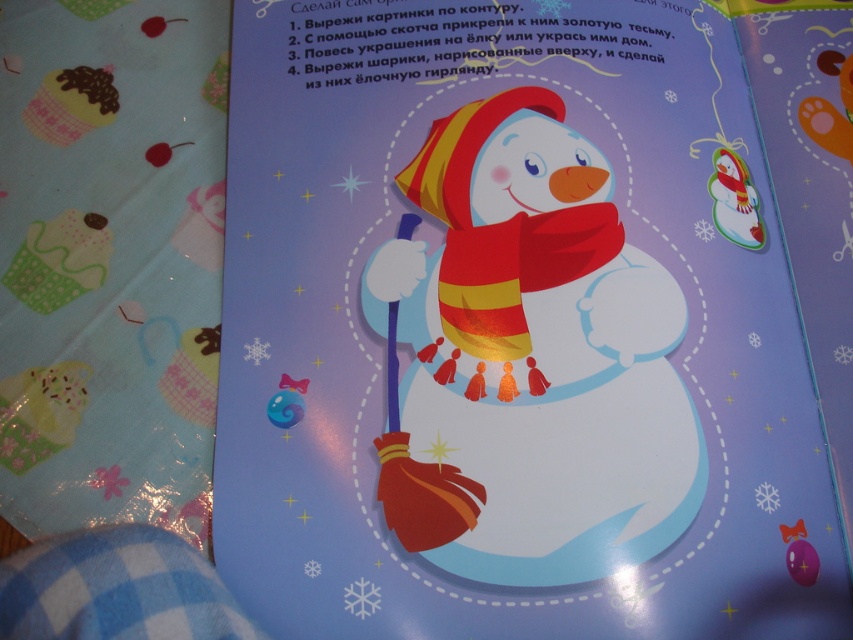
You are an artist drawing a snowman on a page. You want to place the snowman exactly at the center of the page. According to the image, is the matte paper snowman at center positioned correctly?

The matte paper snowman at center is positioned at point (537, 317), which is very close to the center coordinates of (426, 320). Therefore, it is correctly positioned at the center of the page.